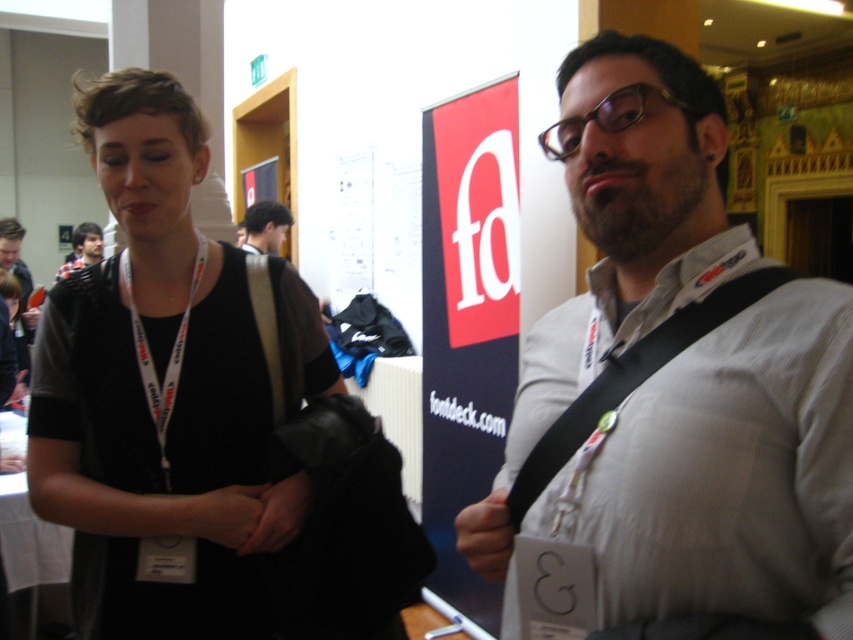
Which is below, white textured shirt at center or dark blue shirt at upper left?

Positioned lower is white textured shirt at center.

Is white textured shirt at center above dark blue shirt at upper left?

No.

Describe the element at coordinates (727, 474) in the screenshot. I see `white textured shirt at center` at that location.

Find the location of `white textured shirt at center`. white textured shirt at center is located at coordinates (727, 474).

Can you confirm if white fabric lanyard at center is smaller than dark blue shirt at upper left?

Indeed, white fabric lanyard at center has a smaller size compared to dark blue shirt at upper left.

Where is `white fabric lanyard at center`? white fabric lanyard at center is located at coordinates (169, 355).

The height and width of the screenshot is (640, 853). Find the location of `white fabric lanyard at center`. white fabric lanyard at center is located at coordinates (169, 355).

Can you confirm if white textured shirt at center is thinner than white fabric lanyard at center?

Incorrect, white textured shirt at center's width is not less than white fabric lanyard at center's.

This screenshot has width=853, height=640. What do you see at coordinates (727, 474) in the screenshot?
I see `white textured shirt at center` at bounding box center [727, 474].

Find the location of `white textured shirt at center`. white textured shirt at center is located at coordinates (727, 474).